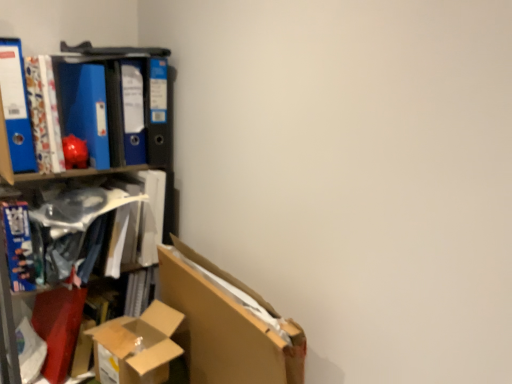
Question: From a real-world perspective, is matte plastic book at left, the first book when ordered from right to left, positioned above or below cardboard box at lower left?

Choices:
 (A) above
 (B) below

Answer: (A)

Question: Does point click(x=48, y=205) appear closer or farther from the camera than point click(x=98, y=329)?

Choices:
 (A) closer
 (B) farther

Answer: (B)

Question: Considering the real-world distances, which object is farthest from the blue matte folder at upper left, which is the first paperback book in right-to-left order?

Choices:
 (A) blue glossy book at left, acting as the second book starting from the right
 (B) matte plastic book at left, which is the 2th book from left to right
 (C) blue matte folder at left, arranged as the 1th paperback book when viewed from the left
 (D) blue matte folder at upper left, marked as the 2th paperback book in a left-to-right arrangement
 (E) cardboard box at lower left

Answer: (E)

Question: Based on their relative distances, which object is nearer to the blue matte folder at upper left, the 3th paperback book positioned from the left?

Choices:
 (A) blue matte folder at left, arranged as the 1th paperback book when viewed from the left
 (B) blue matte folder at upper left, positioned as the second paperback book in right-to-left order
 (C) cardboard box at lower left
 (D) blue glossy book at left, acting as the second book starting from the right
 (E) matte plastic book at left, the first book when ordered from right to left

Answer: (B)